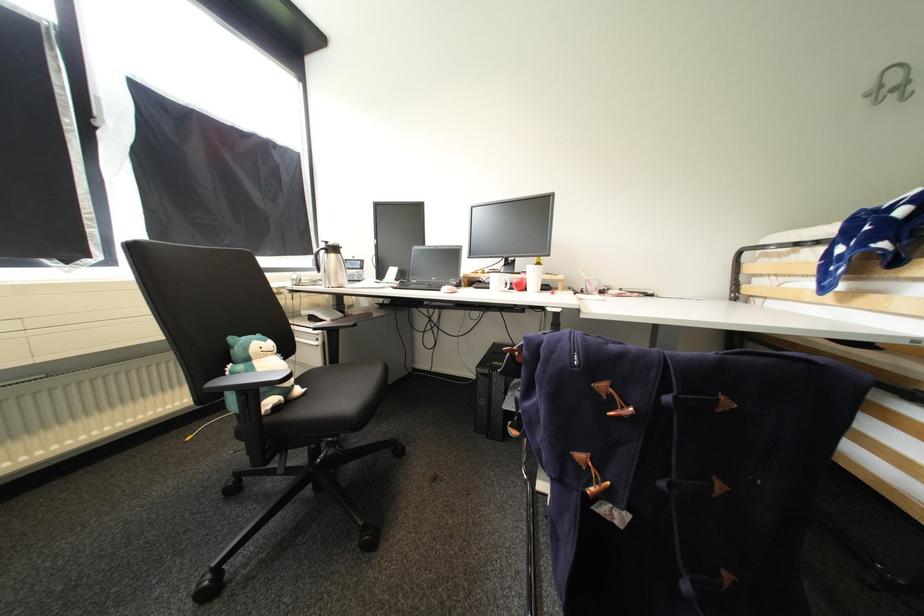
Where is `white cup`? This screenshot has width=924, height=616. white cup is located at coordinates (533, 276).